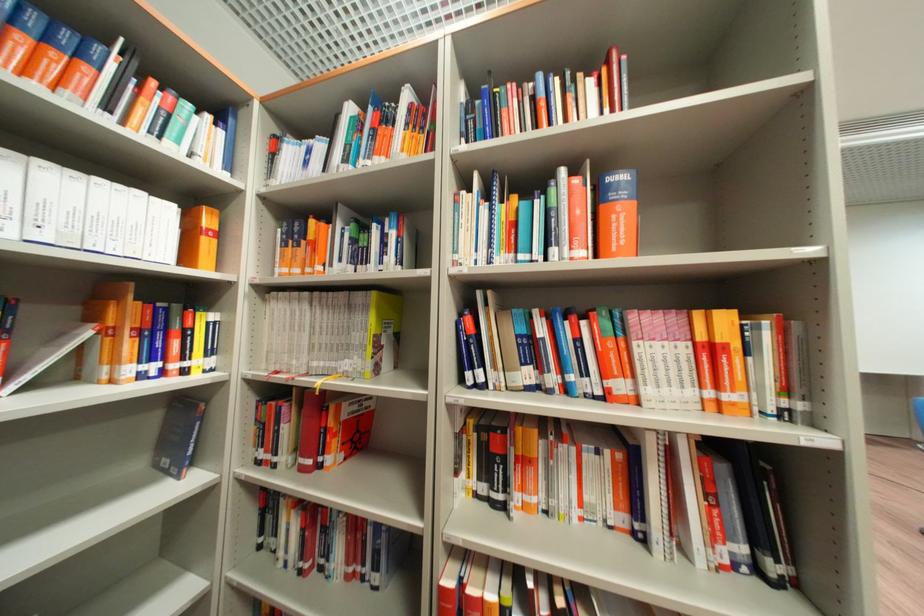
Describe the element at coordinates (177, 436) in the screenshot. I see `the dark blue book` at that location.